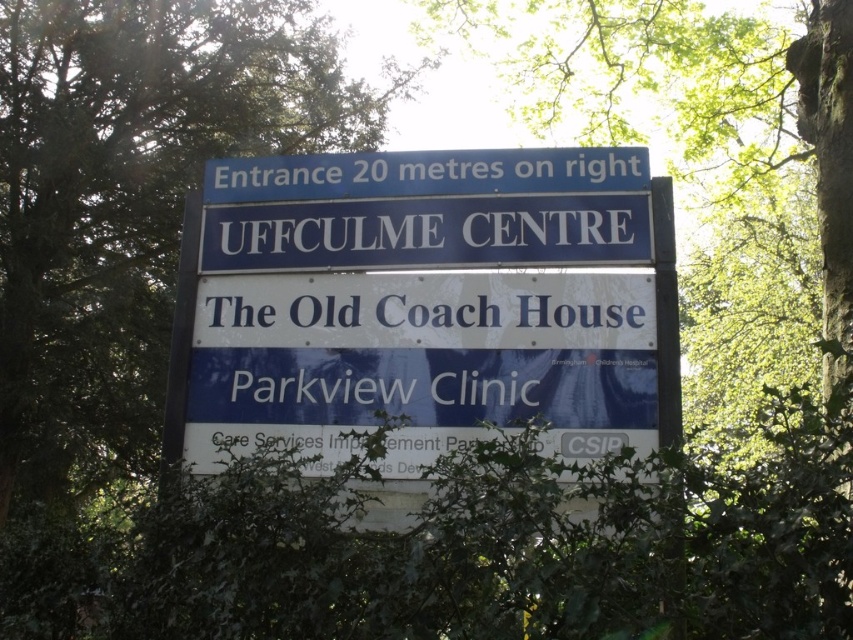
Question: Which object appears farthest from the camera in this image?

Choices:
 (A) blue plastic sign at center
 (B) blue metallic sign at upper center

Answer: (B)

Question: Is blue plastic sign at center to the left of white painted signboard at center from the viewer's perspective?

Choices:
 (A) yes
 (B) no

Answer: (A)

Question: Can you confirm if blue metallic sign at upper center is bigger than white painted signboard at center?

Choices:
 (A) yes
 (B) no

Answer: (A)

Question: Which point is farther from the camera taking this photo?

Choices:
 (A) (467, 317)
 (B) (587, 336)
 (C) (425, 157)

Answer: (C)

Question: Is blue plastic sign at center thinner than blue metallic sign at upper center?

Choices:
 (A) yes
 (B) no

Answer: (A)

Question: Which of the following is the closest to the observer?

Choices:
 (A) blue metallic sign at upper center
 (B) white painted signboard at center

Answer: (B)